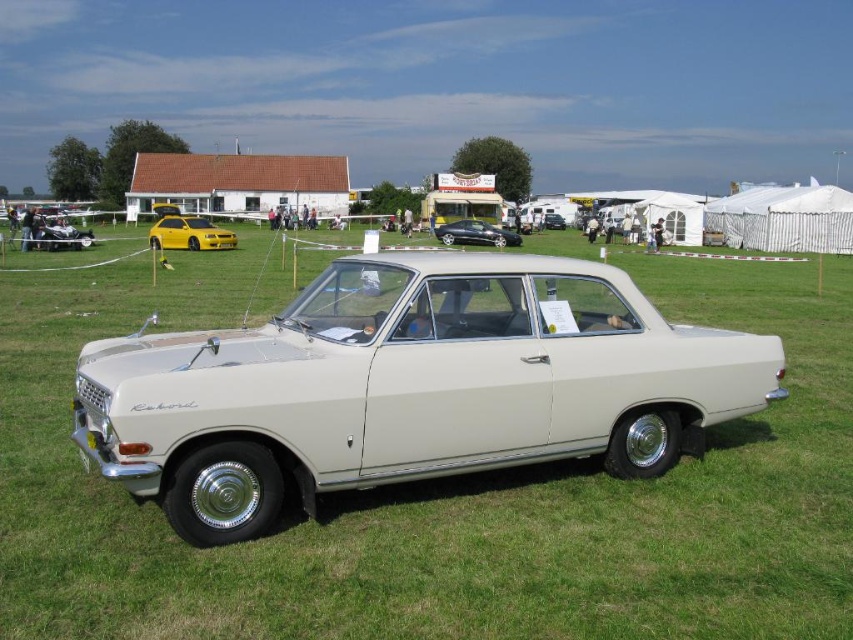
Question: Which of the following is the closest to the observer?

Choices:
 (A) (331, 381)
 (B) (474, 236)
 (C) (550, 225)

Answer: (A)

Question: Considering the relative positions of yellow metallic hatchback at center and white glossy sedan at center in the image provided, where is yellow metallic hatchback at center located with respect to white glossy sedan at center?

Choices:
 (A) above
 (B) below

Answer: (B)

Question: Which point appears farthest from the camera in this image?

Choices:
 (A) (561, 227)
 (B) (663, 440)
 (C) (450, 227)

Answer: (A)

Question: Does beige metallic sedan at center have a greater width compared to white glossy sedan at center?

Choices:
 (A) yes
 (B) no

Answer: (A)

Question: Based on their relative distances, which object is nearer to the yellow metallic hatchback at center?

Choices:
 (A) satin black sedan at center
 (B) white glossy sedan at center
 (C) beige metallic sedan at center

Answer: (A)

Question: Is yellow metallic hatchback at center positioned behind white glossy sedan at center?

Choices:
 (A) yes
 (B) no

Answer: (B)